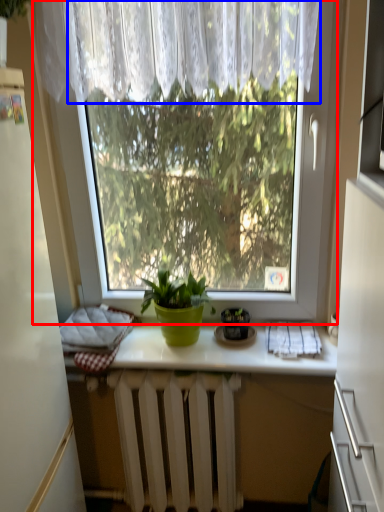
Question: Which point is further to the camera, window (highlighted by a red box) or curtain (highlighted by a blue box)?

Choices:
 (A) window
 (B) curtain

Answer: (A)